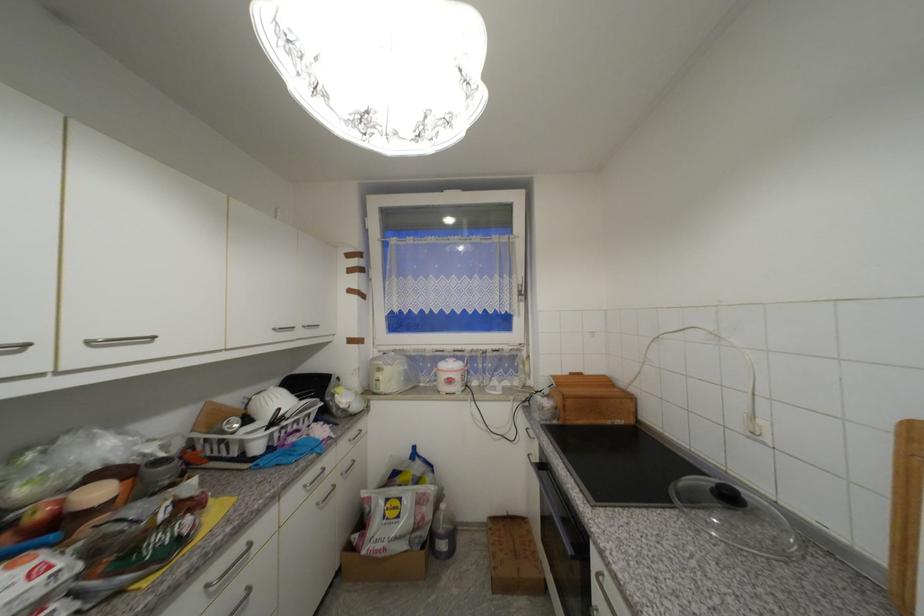
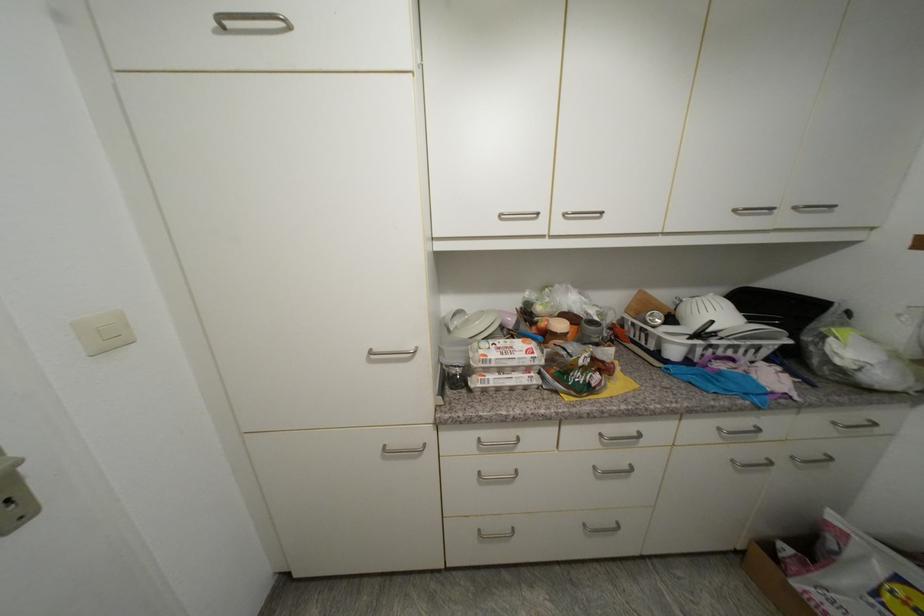
Looking at this image, the first image is from the beginning of the video and the second image is from the end. How did the camera likely rotate when shooting the video?

The rotation direction of the camera is left-down.